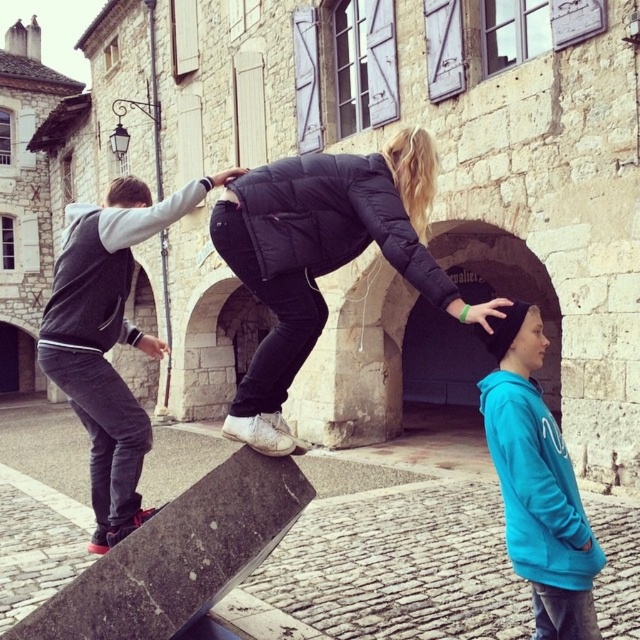
Which is behind, point (284, 445) or point (598, 628)?

Point (284, 445)

You are a GUI agent. You are given a task and a screenshot of the screen. Output one action in this format:
    pyautogui.click(x=<x>, y=<y>)
    Task: Click on the black puffer jacket at center
    This screenshot has width=640, height=640.
    Given the screenshot: What is the action you would take?
    pyautogui.click(x=323, y=257)

Locate an element on the screen. black puffer jacket at center is located at coordinates (323, 257).

Does black puffer jacket at center appear over dark gray hoodie at left?

Indeed, black puffer jacket at center is positioned over dark gray hoodie at left.

Is black puffer jacket at center below dark gray hoodie at left?

No, black puffer jacket at center is not below dark gray hoodie at left.

The width and height of the screenshot is (640, 640). I want to click on black puffer jacket at center, so click(323, 257).

Image resolution: width=640 pixels, height=640 pixels. I want to click on black puffer jacket at center, so click(323, 257).

Which is above, dark gray hoodie at left or turquoise hoodie at right?

Positioned higher is dark gray hoodie at left.

Measure the distance between dark gray hoodie at left and camera.

dark gray hoodie at left and camera are 68.47 feet apart.

You are a GUI agent. You are given a task and a screenshot of the screen. Output one action in this format:
    pyautogui.click(x=<x>, y=<y>)
    Task: Click on the dark gray hoodie at left
    
    Given the screenshot: What is the action you would take?
    pyautogui.click(x=108, y=339)